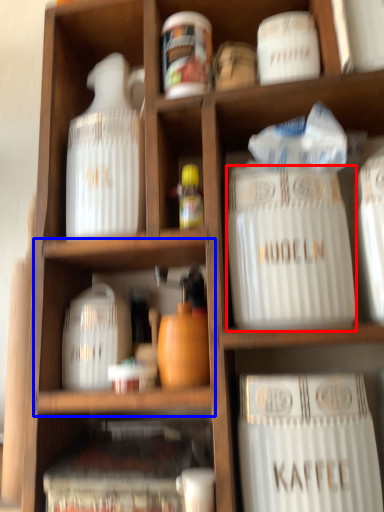
Question: Which object is further to the camera taking this photo, type (highlighted by a red box) or cabinet (highlighted by a blue box)?

Choices:
 (A) type
 (B) cabinet

Answer: (B)